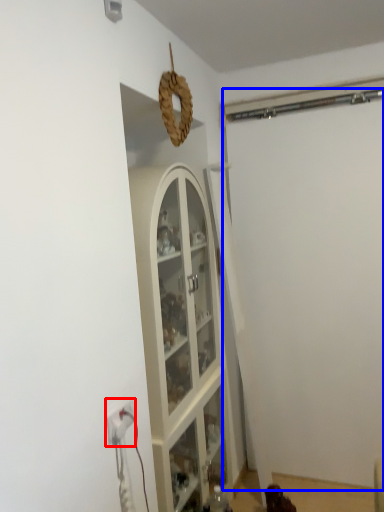
Question: Which of the following is the closest to the observer, electric outlet (highlighted by a red box) or garage door (highlighted by a blue box)?

Choices:
 (A) electric outlet
 (B) garage door

Answer: (A)